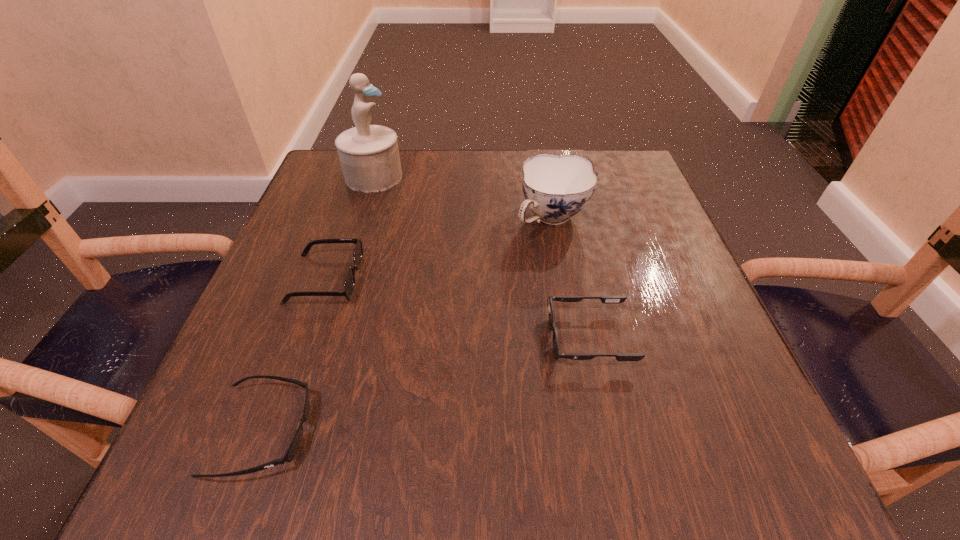
In the image, there is a desktop. Where is `free space at the far right corner`? The width and height of the screenshot is (960, 540). free space at the far right corner is located at coordinates (622, 169).

This screenshot has height=540, width=960. In the image, there is a desktop. What are the coordinates of `vacant region at the near right corner` in the screenshot? It's located at (698, 461).

Where is `empty space that is in between the fourth farthest object and the farthest object`? The width and height of the screenshot is (960, 540). empty space that is in between the fourth farthest object and the farthest object is located at coordinates 481,257.

This screenshot has height=540, width=960. Identify the location of unoccupied position between the rightmost sunglasses and the nearest sunglasses. (426, 384).

Where is `vacant point located between the tallest object and the second nearest sunglasses`? vacant point located between the tallest object and the second nearest sunglasses is located at coordinates (481, 257).

What are the coordinates of `empty space that is in between the chinaware and the tallest object` in the screenshot? It's located at (463, 198).

Find the location of a particular element. Image resolution: width=960 pixels, height=540 pixels. vacant space that's between the tallest object and the nearest object is located at coordinates (319, 304).

The image size is (960, 540). Find the location of `free spot between the nearest object and the fourth shortest object`. free spot between the nearest object and the fourth shortest object is located at coordinates (407, 325).

Find the location of a particular element. This screenshot has width=960, height=540. free area in between the second tallest object and the third tallest object is located at coordinates (439, 248).

Where is `free point between the nearest object and the third tallest object`? The height and width of the screenshot is (540, 960). free point between the nearest object and the third tallest object is located at coordinates (295, 355).